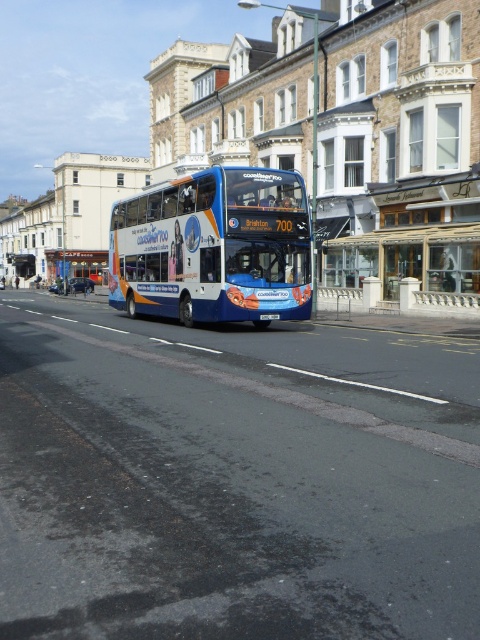
Question: Is blue metallic bus at center bigger than black plastic license plate at center?

Choices:
 (A) yes
 (B) no

Answer: (A)

Question: Is blue metallic bus at center wider than black plastic license plate at center?

Choices:
 (A) yes
 (B) no

Answer: (A)

Question: Is the position of blue metallic bus at center more distant than that of black plastic license plate at center?

Choices:
 (A) no
 (B) yes

Answer: (A)